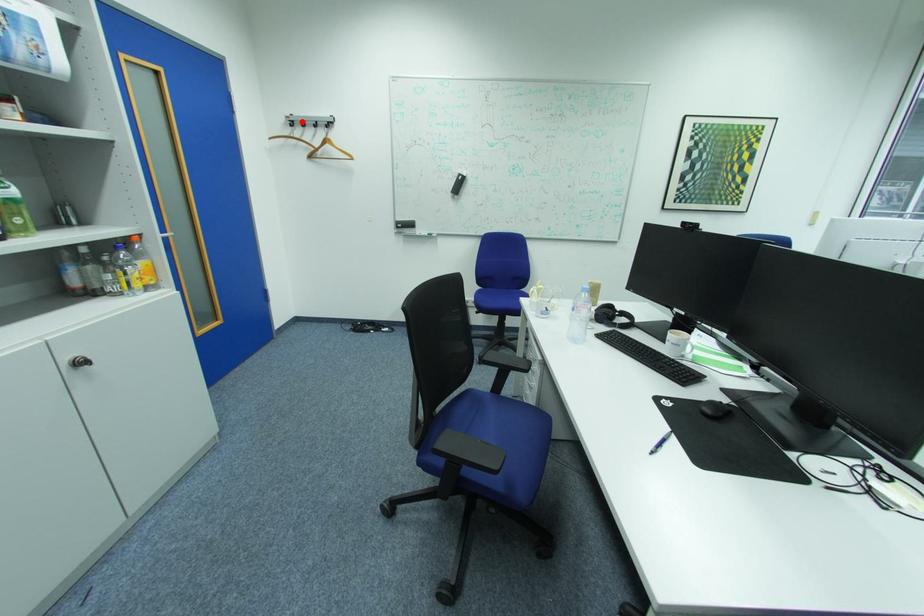
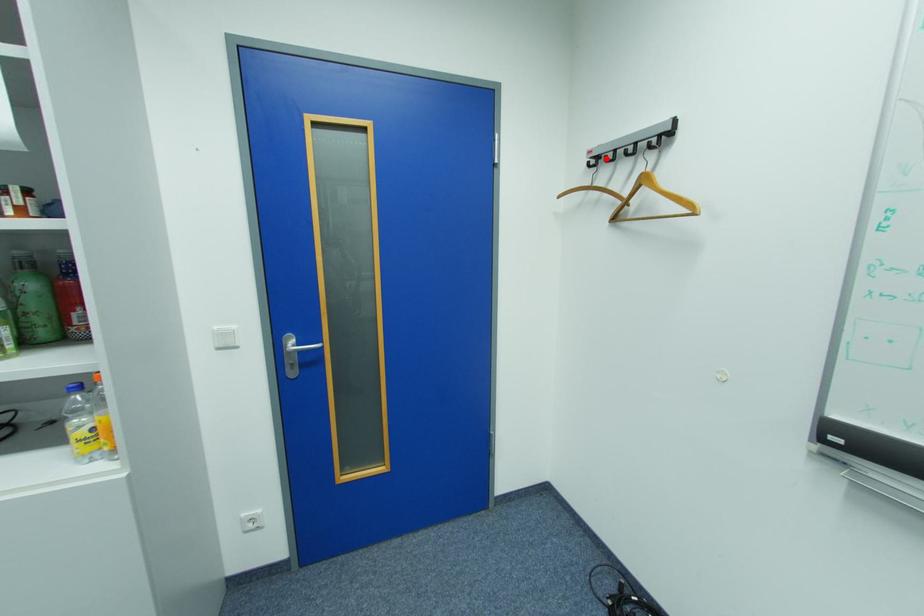
I am providing you with two images of the same scene from different viewpoints. A red point is marked on the first image and another point is marked on the second image. Are the points marked in image1 and image2 representing the same 3D position?

Yes